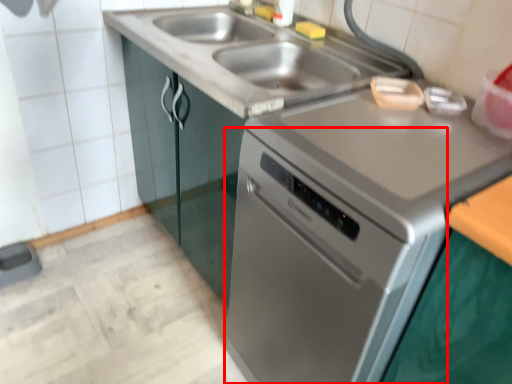
Question: In this image, where is oven (annotated by the red box) located relative to sink?

Choices:
 (A) right
 (B) left

Answer: (A)